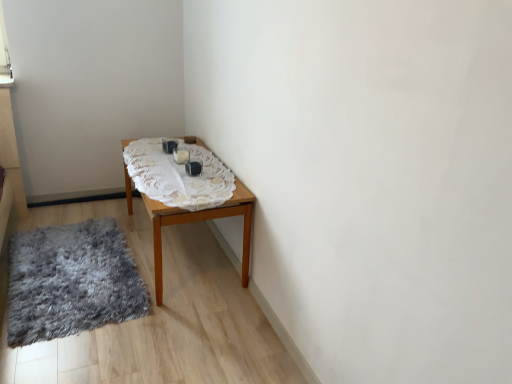
Question: Can you confirm if shaggy gray rug at lower left is thinner than wooden table at center?

Choices:
 (A) no
 (B) yes

Answer: (A)

Question: From a real-world perspective, is shaggy gray rug at lower left beneath wooden table at center?

Choices:
 (A) no
 (B) yes

Answer: (B)

Question: From the image's perspective, would you say shaggy gray rug at lower left is positioned over wooden table at center?

Choices:
 (A) yes
 (B) no

Answer: (B)

Question: Can wooden table at center be found inside shaggy gray rug at lower left?

Choices:
 (A) no
 (B) yes

Answer: (A)

Question: Does shaggy gray rug at lower left have a lesser height compared to wooden table at center?

Choices:
 (A) no
 (B) yes

Answer: (B)

Question: Is wooden table at center taller or shorter than shaggy gray rug at lower left?

Choices:
 (A) tall
 (B) short

Answer: (A)

Question: Considering the positions of wooden table at center and shaggy gray rug at lower left in the image, is wooden table at center bigger or smaller than shaggy gray rug at lower left?

Choices:
 (A) big
 (B) small

Answer: (A)

Question: Would you say wooden table at center is inside or outside shaggy gray rug at lower left?

Choices:
 (A) inside
 (B) outside

Answer: (B)

Question: From the image's perspective, relative to shaggy gray rug at lower left, is wooden table at center above or below?

Choices:
 (A) below
 (B) above

Answer: (B)

Question: In terms of size, does wooden table at center appear bigger or smaller than white lace tablecloth at center?

Choices:
 (A) small
 (B) big

Answer: (B)

Question: From the image's perspective, is wooden table at center above or below white lace tablecloth at center?

Choices:
 (A) above
 (B) below

Answer: (B)

Question: Considering the positions of point (217, 211) and point (178, 172), is point (217, 211) closer or farther from the camera than point (178, 172)?

Choices:
 (A) farther
 (B) closer

Answer: (B)

Question: From their relative heights in the image, would you say wooden table at center is taller or shorter than white lace tablecloth at center?

Choices:
 (A) tall
 (B) short

Answer: (A)

Question: Would you say shaggy gray rug at lower left is inside or outside white lace tablecloth at center?

Choices:
 (A) outside
 (B) inside

Answer: (A)

Question: From a real-world perspective, relative to white lace tablecloth at center, is shaggy gray rug at lower left vertically above or below?

Choices:
 (A) above
 (B) below

Answer: (B)